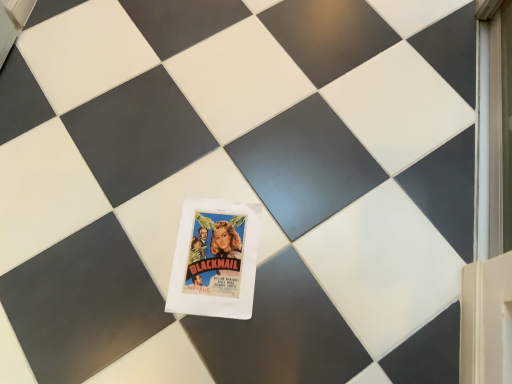
Find the location of a particular element. Image resolution: width=512 pixels, height=384 pixels. free space that is to the left of matte paper poster at center is located at coordinates (131, 270).